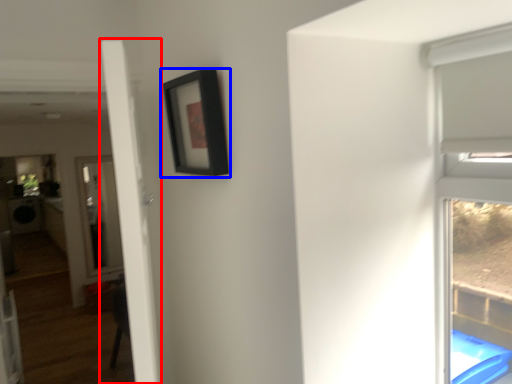
Question: Which point is closer to the camera, door (highlighted by a red box) or picture frame (highlighted by a blue box)?

Choices:
 (A) door
 (B) picture frame

Answer: (A)